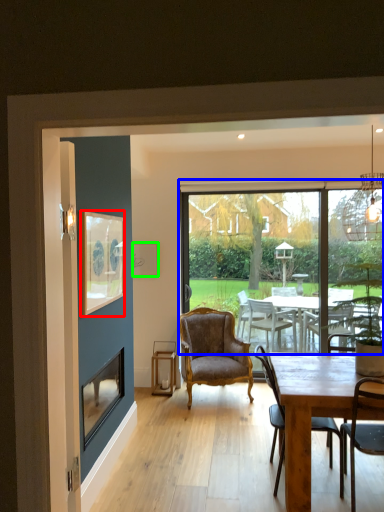
Question: Which object is positioned closest to picture frame (highlighted by a red box)? Select from window (highlighted by a blue box) and picture frame (highlighted by a green box).

Choices:
 (A) window
 (B) picture frame

Answer: (B)